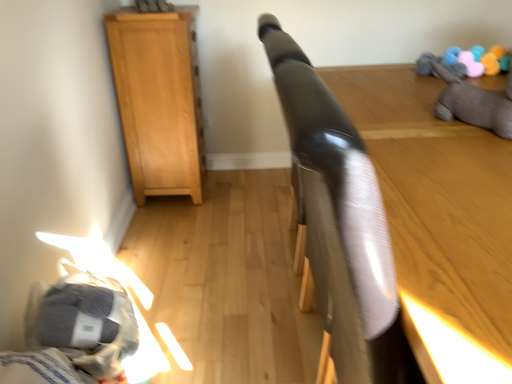
At what (x,y) coordinates should I click in order to perform the action: click on vacant space in front of light brown wood cabinet at left, marked as the 1th furniture in a back-to-front arrangement. Please return your answer as a coordinate pair (x, y). This screenshot has width=512, height=384. Looking at the image, I should click on click(181, 228).